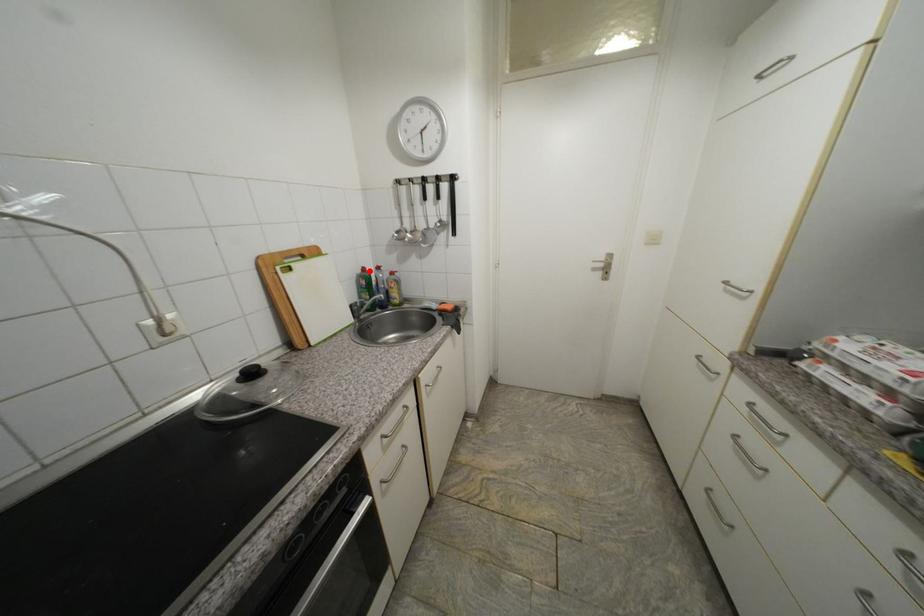
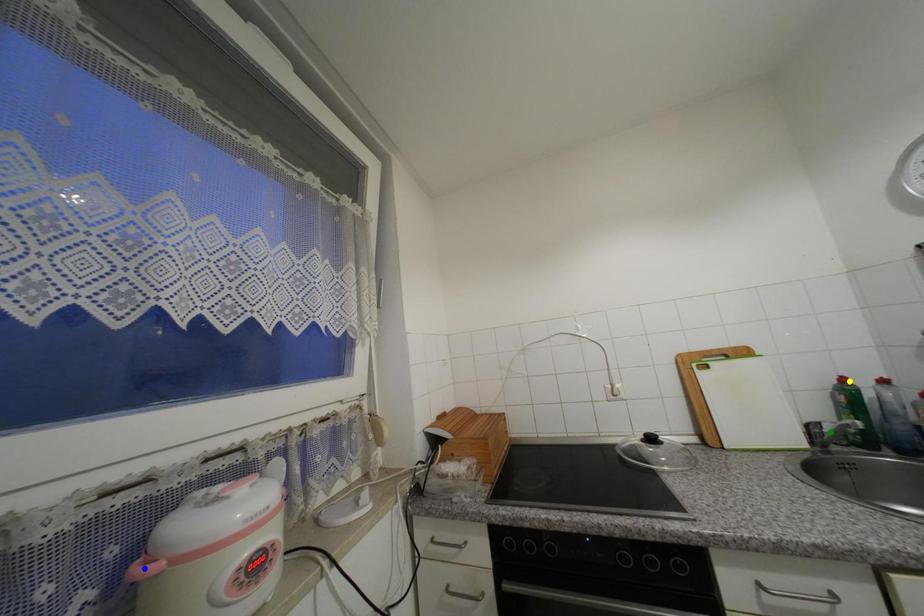
Question: I am providing you with two images of the same scene from different viewpoints. A red point is marked on the first image. You are given multiple points on the second image. In image 2, which mark is for the same physical point as the one in image 1?

Choices:
 (A) blue point
 (B) green point
 (C) yellow point

Answer: (C)